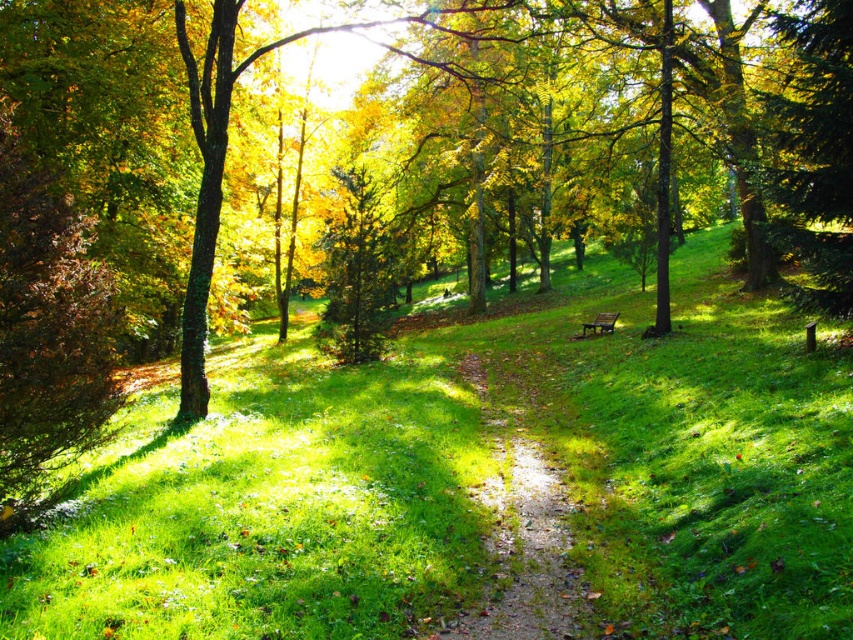
Question: In this image, where is green grassy at center located relative to wooden park bench at center?

Choices:
 (A) below
 (B) above

Answer: (A)

Question: Considering the real-world distances, which object is farthest from the green grassy at center?

Choices:
 (A) dirt path at center
 (B) wooden park bench at center

Answer: (B)

Question: Which point appears farthest from the camera in this image?

Choices:
 (A) (602, 320)
 (B) (554, 621)

Answer: (A)

Question: Is green grassy at center to the left of dirt path at center from the viewer's perspective?

Choices:
 (A) yes
 (B) no

Answer: (A)

Question: Can you confirm if dirt path at center is wider than wooden park bench at center?

Choices:
 (A) no
 (B) yes

Answer: (B)

Question: Which of the following is the farthest from the observer?

Choices:
 (A) green grassy at center
 (B) wooden park bench at center
 (C) dirt path at center

Answer: (B)